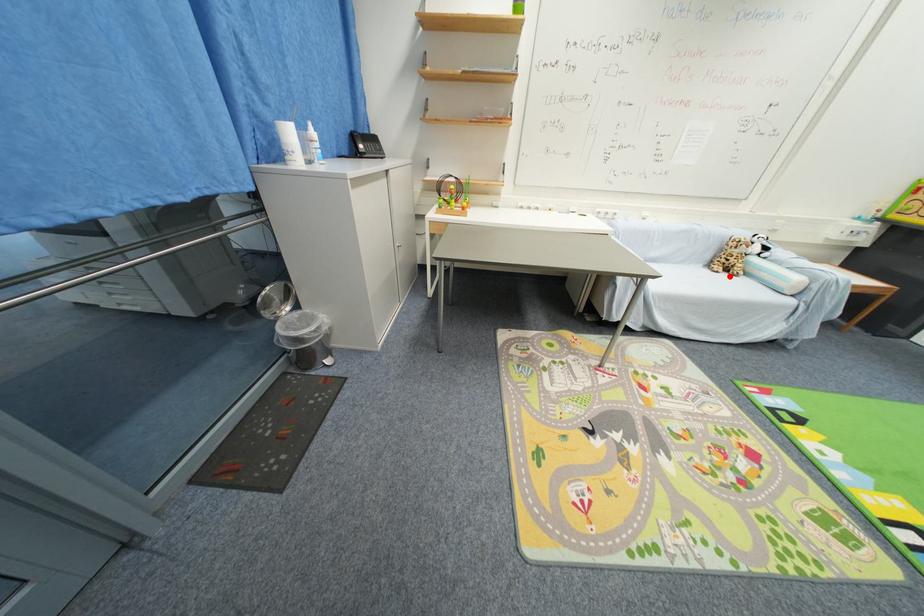
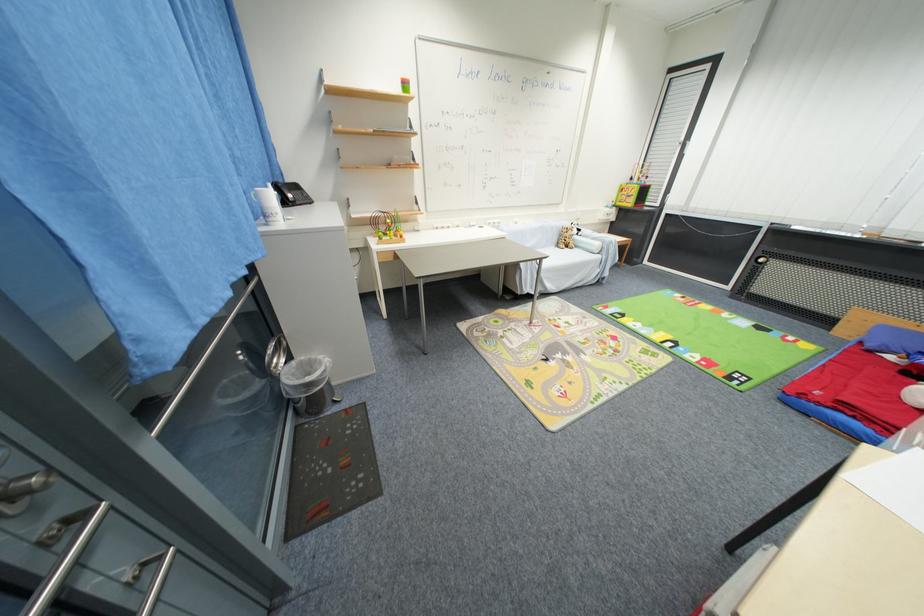
The point at the highlighted location is marked in the first image. Where is the corresponding point in the second image?

(572, 251)